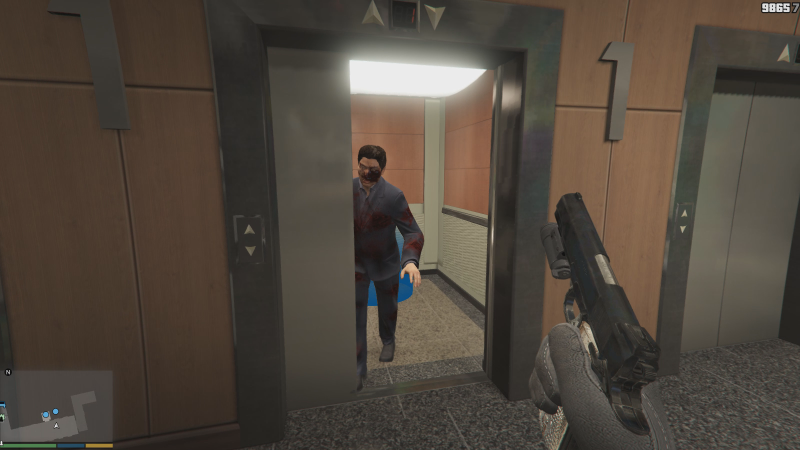
I want to click on elevator doors, so click(x=762, y=300).